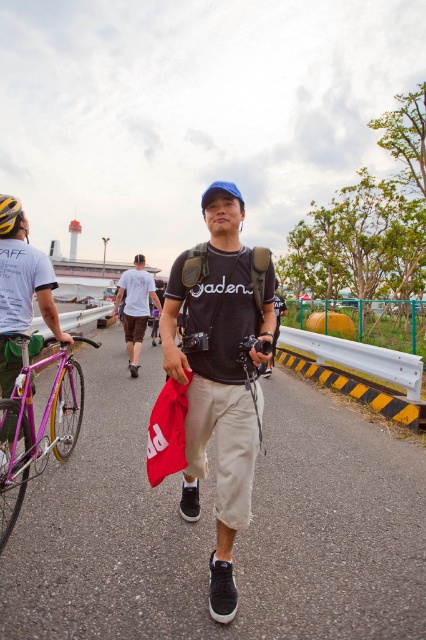
Question: Which object is positioned closest to the metallic purple bicycle at left?

Choices:
 (A) purple metallic bicycle at left
 (B) white cotton t-shirt at center

Answer: (A)

Question: Can you confirm if purple metallic bicycle at left is positioned to the left of white cotton t-shirt at center?

Choices:
 (A) no
 (B) yes

Answer: (B)

Question: Considering the relative positions of khaki cotton pants at center and purple metallic bicycle at left in the image provided, where is khaki cotton pants at center located with respect to purple metallic bicycle at left?

Choices:
 (A) left
 (B) right

Answer: (B)

Question: Can you confirm if purple metallic bicycle at left is positioned to the left of white cotton t-shirt at center?

Choices:
 (A) no
 (B) yes

Answer: (B)

Question: Which object is closer to the camera taking this photo?

Choices:
 (A) khaki cotton pants at center
 (B) purple metallic bicycle at left

Answer: (A)

Question: Which of the following is the closest to the observer?

Choices:
 (A) purple metallic bicycle at left
 (B) khaki cotton pants at center

Answer: (B)